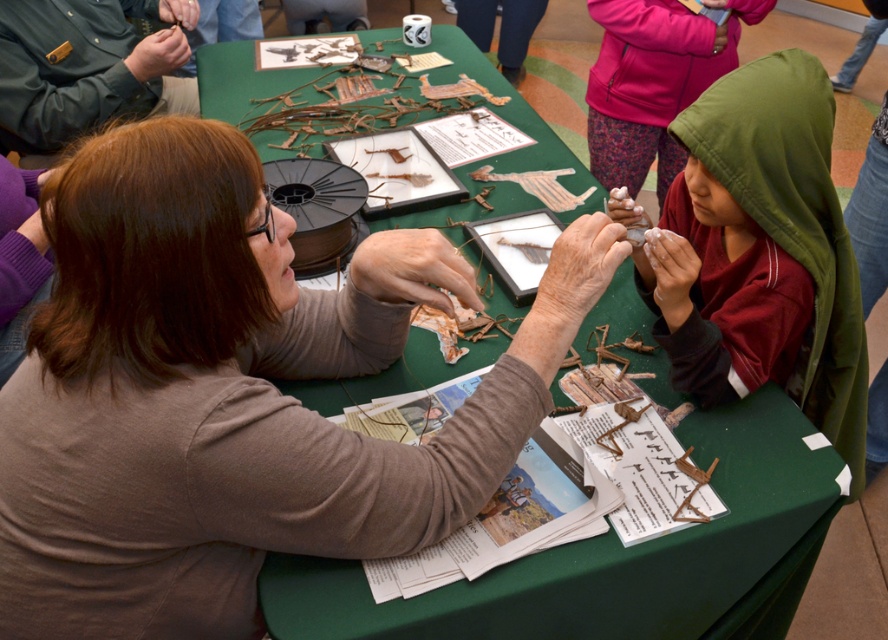
Question: Is brown textured paper at center further to the viewer compared to green fabric table at center?

Choices:
 (A) no
 (B) yes

Answer: (A)

Question: Which object is the closest to the green uniform at upper left?

Choices:
 (A) brown textured paper at center
 (B) green fabric table at center

Answer: (B)

Question: Considering the relative positions of green fabric table at center and green uniform at upper left in the image provided, where is green fabric table at center located with respect to green uniform at upper left?

Choices:
 (A) above
 (B) below

Answer: (B)

Question: Which object appears closest to the camera in this image?

Choices:
 (A) green fabric table at center
 (B) green hooded sweatshirt at upper right
 (C) green uniform at upper left

Answer: (A)

Question: Does brown textured paper at center appear on the left side of green uniform at upper left?

Choices:
 (A) yes
 (B) no

Answer: (B)

Question: Among these points, which one is farthest from the camera?

Choices:
 (A) (426, 336)
 (B) (94, 97)
 (C) (633, 19)
 (D) (224, 273)

Answer: (B)